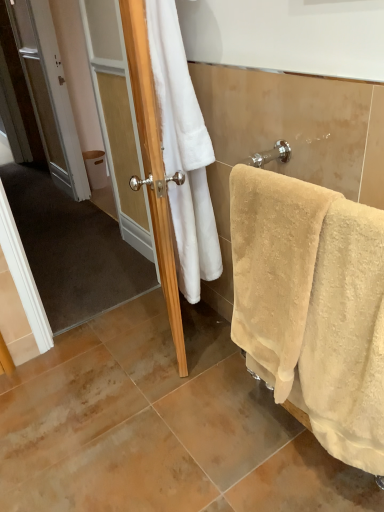
Locate an element on the screen. free spot below white fluffy towel at left (from a real-world perspective) is located at coordinates (202, 336).